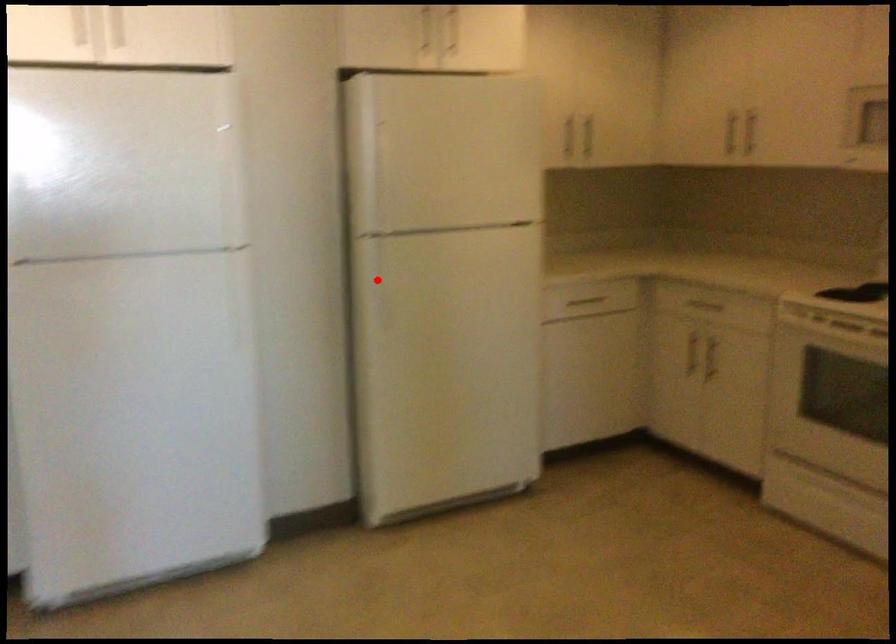
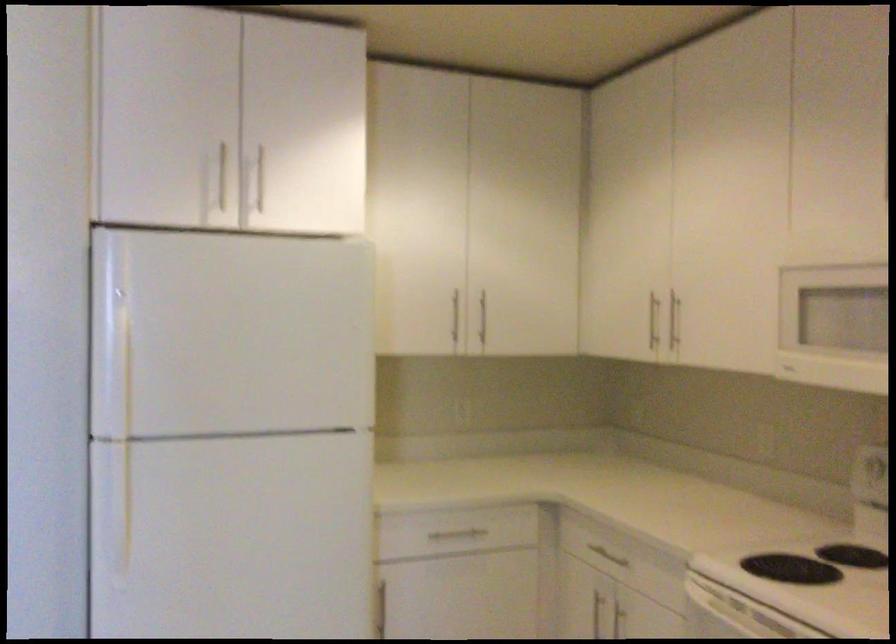
Locate, in the second image, the point that corresponds to the highlighted location in the first image.

(113, 505)